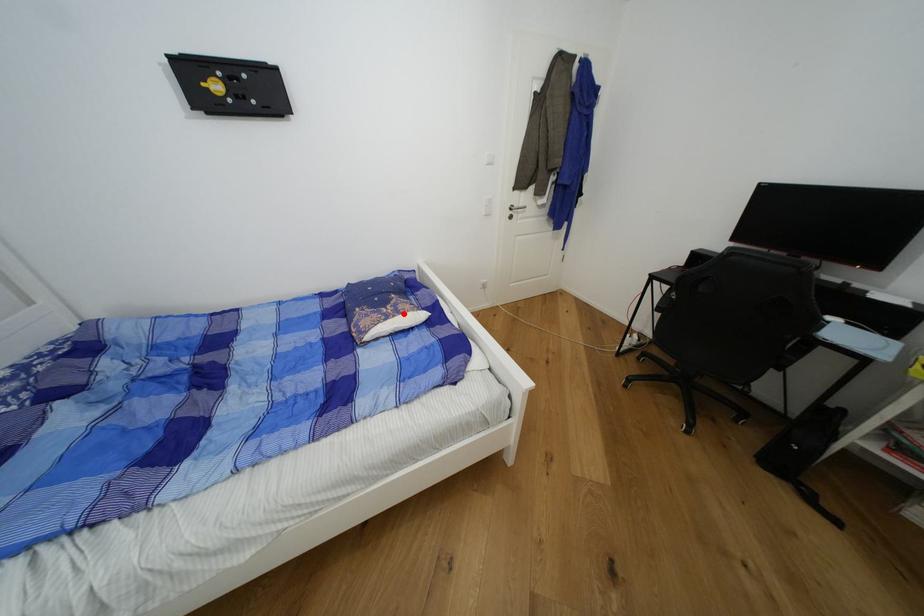
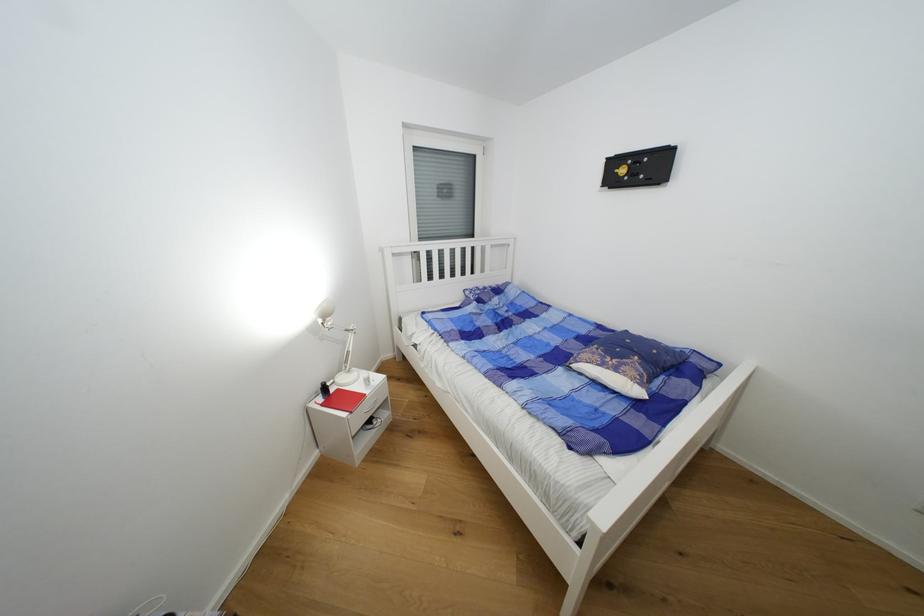
Locate, in the second image, the point that corresponds to the highlighted location in the first image.

(622, 371)